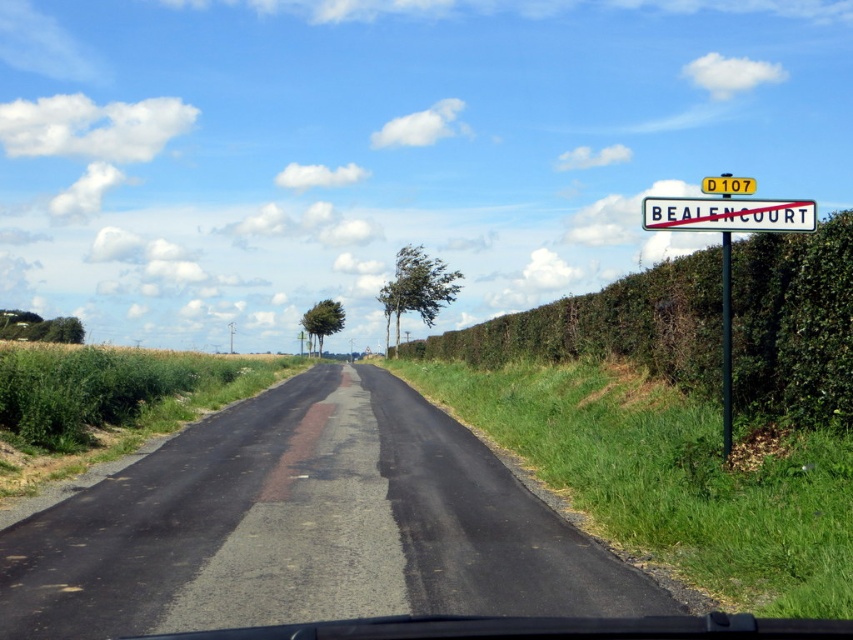
Question: Estimate the real-world distances between objects in this image. Which object is closer to the white plastic sign at upper right?

Choices:
 (A) green leafy hedge at right
 (B) black metal signpost at upper right
 (C) yellow plastic sign at upper center

Answer: (B)

Question: Which point is farther to the camera?

Choices:
 (A) (668, 211)
 (B) (724, 257)
 (C) (720, 180)
 (D) (822, 385)

Answer: (B)

Question: Which point is farther to the camera?

Choices:
 (A) yellow plastic sign at upper center
 (B) black metal signpost at upper right
 (C) white plastic sign at upper right

Answer: (A)

Question: Can you confirm if green leafy hedge at right is positioned to the left of yellow plastic sign at upper center?

Choices:
 (A) no
 (B) yes

Answer: (B)

Question: Does black metal signpost at upper right have a greater width compared to yellow plastic sign at upper center?

Choices:
 (A) yes
 (B) no

Answer: (B)

Question: Is black metal signpost at upper right further to camera compared to yellow plastic sign at upper center?

Choices:
 (A) yes
 (B) no

Answer: (B)